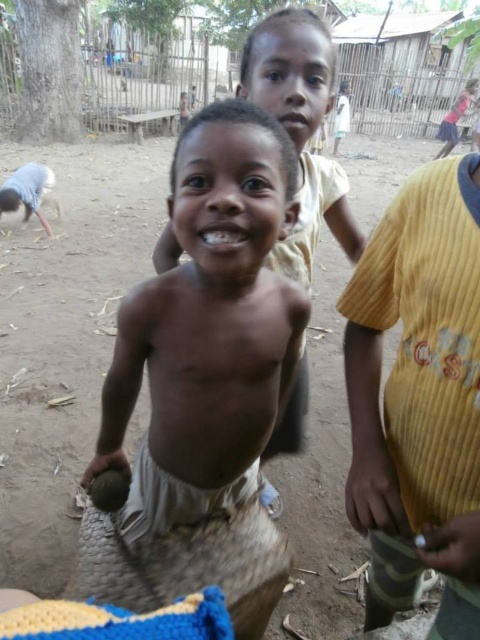
In the scene shown: You are a photographer setting up a camera to capture the two children in the scene. The yellow corduroy shirt at right and the pink matte mouth at upper center are both in your viewfinder. Which object should you focus on if you want to ensure the larger one is sharp?

You should focus on the yellow corduroy shirt at right because it is larger in size than the pink matte mouth at upper center.

You are standing in the middle of the scene and want to walk to the point closer to you between point (399,202) and point (282,120). Which point should you head towards?

You should head towards point (399,202) because it is closer to you than point (282,120).